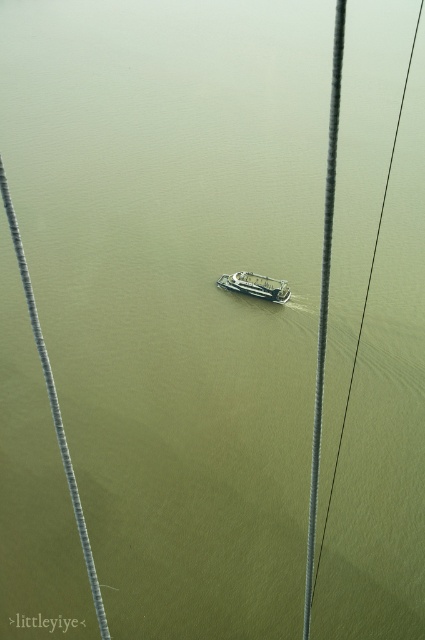
Does metallic wire at center appear on the left side of green metallic boat at center?

Incorrect, metallic wire at center is not on the left side of green metallic boat at center.

Can you confirm if metallic wire at center is shorter than green metallic boat at center?

No.

What do you see at coordinates (365, 301) in the screenshot? Image resolution: width=425 pixels, height=640 pixels. I see `metallic wire at center` at bounding box center [365, 301].

At what (x,y) coordinates should I click in order to perform the action: click on metallic wire at center. Please return your answer as a coordinate pair (x, y). The image size is (425, 640). Looking at the image, I should click on (365, 301).

Can you confirm if metallic gray cable at center is wider than green metallic boat at center?

Incorrect, metallic gray cable at center's width does not surpass green metallic boat at center's.

Can you confirm if metallic gray cable at center is bigger than green metallic boat at center?

Yes.

Where is `metallic gray cable at center`? This screenshot has width=425, height=640. metallic gray cable at center is located at coordinates (323, 300).

Between metallic gray cable at center and metallic wire at center, which one is positioned higher?

metallic wire at center

I want to click on metallic gray cable at center, so click(323, 300).

You are a GUI agent. You are given a task and a screenshot of the screen. Output one action in this format:
    pyautogui.click(x=<x>, y=<y>)
    Task: Click on the metallic gray cable at center
    This screenshot has height=640, width=425.
    Given the screenshot: What is the action you would take?
    coord(323,300)

The height and width of the screenshot is (640, 425). Identify the location of metallic gray cable at center. (323, 300).